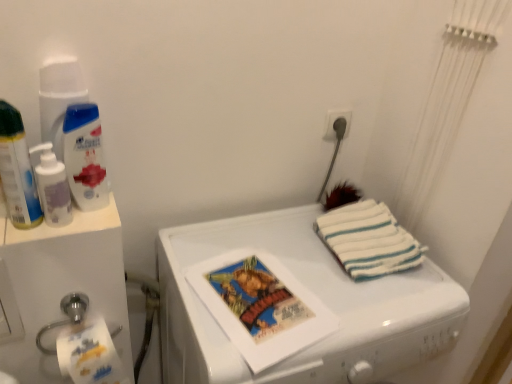
Find the location of a particular element. Image resolution: width=512 pixels, height=384 pixels. vacant region to the left of white striped towel at right is located at coordinates (283, 245).